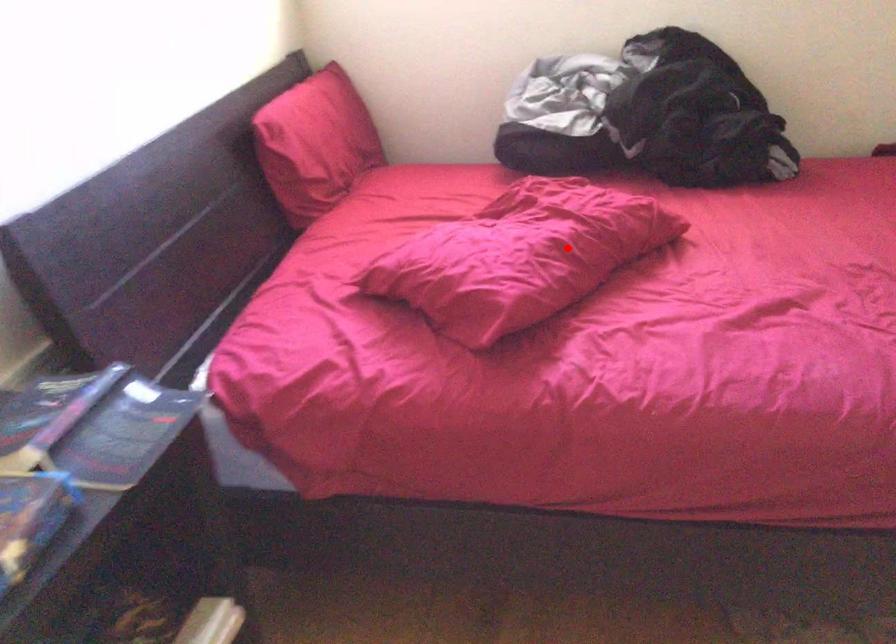
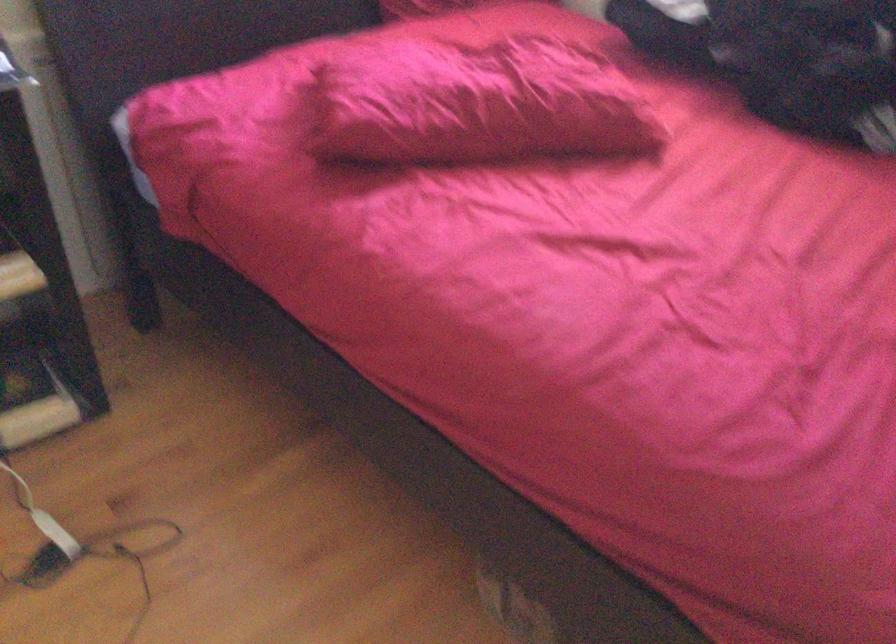
Where in the second image is the point corresponding to the highlighted location from the first image?

(477, 104)